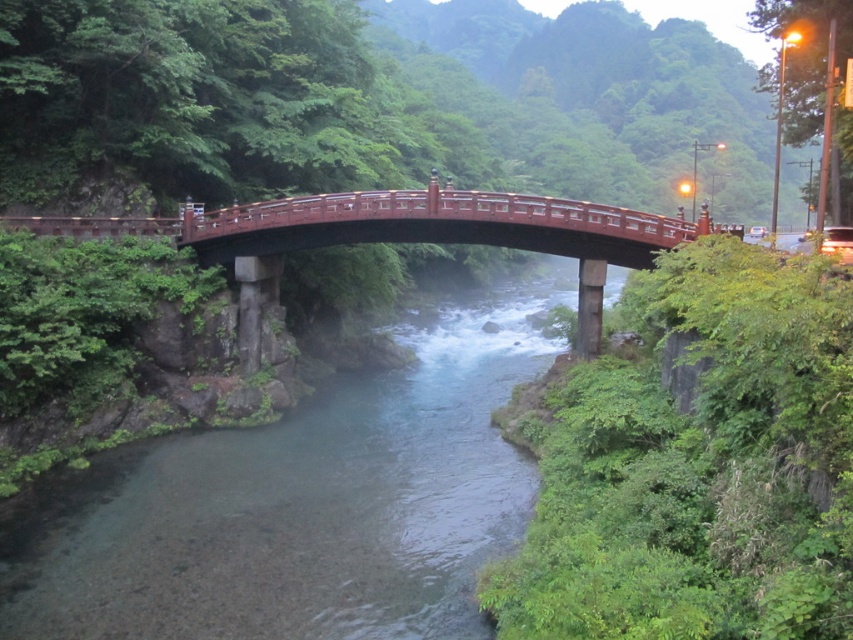
Question: Which point appears farthest from the camera in this image?

Choices:
 (A) (83, 488)
 (B) (556, 227)

Answer: (B)

Question: Considering the relative positions of clear water at center and shiny lacquered bridge at center in the image provided, where is clear water at center located with respect to shiny lacquered bridge at center?

Choices:
 (A) left
 (B) right

Answer: (B)

Question: Is clear water at center bigger than shiny lacquered bridge at center?

Choices:
 (A) no
 (B) yes

Answer: (B)

Question: In this image, where is clear water at center located relative to shiny lacquered bridge at center?

Choices:
 (A) above
 (B) below

Answer: (B)